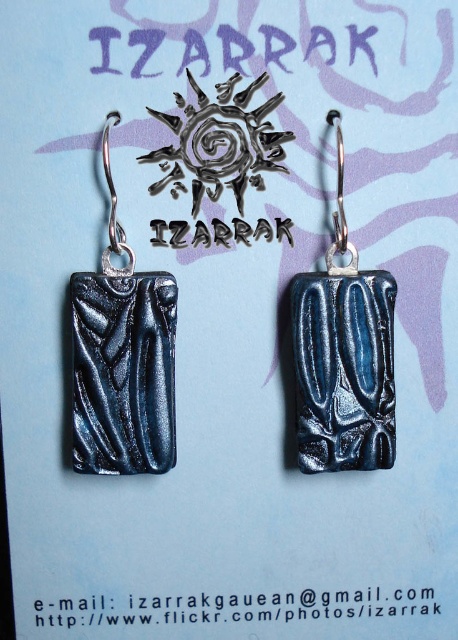
You are an appraiser examining the earrings. The client asks if the metallic blue stone at center is above or below the metallic blue rectangle at center. What do you tell them?

The metallic blue stone at center is positioned under the metallic blue rectangle at center, so it is below the rectangle.

From the picture: You are an appraiser examining the earrings. The client asks if the metallic blue stone at center is covering part of the metallic blue rectangle at center. Based on the description, how would you respond?

The metallic blue stone at center is in front of the metallic blue rectangle at center, so yes, it is covering part of the metallic blue rectangle at center.

You are a jewelry designer who wants to know if the space between the metallic blue stone at center and the metallic blue rectangle at center is large enough to fit a 10 inch chain link. Based on the image, can the chain link fit between them?

The distance between the metallic blue stone at center and the metallic blue rectangle at center is 9.57 inches. Since the chain link is 10 inches, it cannot fit between them as the space is slightly smaller than required.